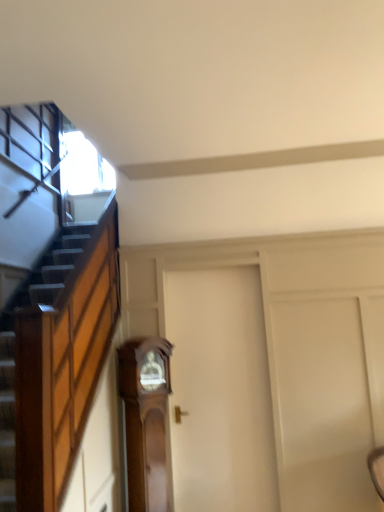
Question: Can you confirm if white matte door at center is smaller than wooden grandfather clock at center?

Choices:
 (A) yes
 (B) no

Answer: (B)

Question: Is white matte door at center to the right of wooden grandfather clock at center from the viewer's perspective?

Choices:
 (A) yes
 (B) no

Answer: (A)

Question: From a real-world perspective, does white matte door at center stand above wooden grandfather clock at center?

Choices:
 (A) no
 (B) yes

Answer: (B)

Question: Does white matte door at center appear on the left side of wooden grandfather clock at center?

Choices:
 (A) no
 (B) yes

Answer: (A)

Question: Is white matte door at center facing away from wooden grandfather clock at center?

Choices:
 (A) no
 (B) yes

Answer: (A)

Question: Can you confirm if white matte door at center is bigger than wooden grandfather clock at center?

Choices:
 (A) no
 (B) yes

Answer: (B)

Question: Is wooden grandfather clock at center positioned beyond the bounds of white matte door at center?

Choices:
 (A) no
 (B) yes

Answer: (B)

Question: Does wooden grandfather clock at center turn towards white matte door at center?

Choices:
 (A) no
 (B) yes

Answer: (A)

Question: Is wooden grandfather clock at center not near white matte door at center?

Choices:
 (A) no
 (B) yes

Answer: (A)

Question: Is wooden grandfather clock at center behind white matte door at center?

Choices:
 (A) yes
 (B) no

Answer: (B)

Question: Can you confirm if wooden grandfather clock at center is shorter than white matte door at center?

Choices:
 (A) no
 (B) yes

Answer: (B)

Question: Can you confirm if wooden grandfather clock at center is wider than white matte door at center?

Choices:
 (A) yes
 (B) no

Answer: (A)

Question: From a real-world perspective, is wooden grandfather clock at center physically located above or below white matte door at center?

Choices:
 (A) below
 (B) above

Answer: (A)